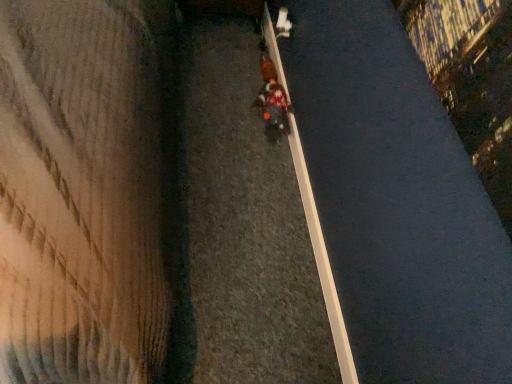
Question: Is white smooth curb at center at the right side of red fabric pedestrian at center?

Choices:
 (A) no
 (B) yes

Answer: (B)

Question: From a real-world perspective, does white smooth curb at center sit lower than red fabric pedestrian at center?

Choices:
 (A) yes
 (B) no

Answer: (A)

Question: From a real-world perspective, is white smooth curb at center physically above red fabric pedestrian at center?

Choices:
 (A) no
 (B) yes

Answer: (A)

Question: Is white smooth curb at center taller than red fabric pedestrian at center?

Choices:
 (A) yes
 (B) no

Answer: (A)

Question: Considering the relative sizes of white smooth curb at center and red fabric pedestrian at center in the image provided, is white smooth curb at center thinner than red fabric pedestrian at center?

Choices:
 (A) no
 (B) yes

Answer: (B)

Question: In terms of height, does white smooth curb at center look taller or shorter compared to red fabric pedestrian at center?

Choices:
 (A) tall
 (B) short

Answer: (A)

Question: Does point (309, 216) appear closer or farther from the camera than point (270, 79)?

Choices:
 (A) closer
 (B) farther

Answer: (A)

Question: Is white smooth curb at center wider or thinner than red fabric pedestrian at center?

Choices:
 (A) wide
 (B) thin

Answer: (B)

Question: In the image, is white smooth curb at center positioned in front of or behind red fabric pedestrian at center?

Choices:
 (A) behind
 (B) front

Answer: (B)

Question: Is red fabric pedestrian at center inside the boundaries of white smooth curb at center, or outside?

Choices:
 (A) inside
 (B) outside

Answer: (B)

Question: Is red fabric pedestrian at center wider or thinner than white smooth curb at center?

Choices:
 (A) thin
 (B) wide

Answer: (B)

Question: Is red fabric pedestrian at center in front of or behind white smooth curb at center in the image?

Choices:
 (A) front
 (B) behind

Answer: (B)

Question: From a real-world perspective, is red fabric pedestrian at center physically located above or below white smooth curb at center?

Choices:
 (A) above
 (B) below

Answer: (A)

Question: Is white smooth curb at center taller or shorter than knitted sweater at center?

Choices:
 (A) short
 (B) tall

Answer: (A)

Question: Considering the positions of point (331, 324) and point (269, 79), is point (331, 324) closer or farther from the camera than point (269, 79)?

Choices:
 (A) farther
 (B) closer

Answer: (B)